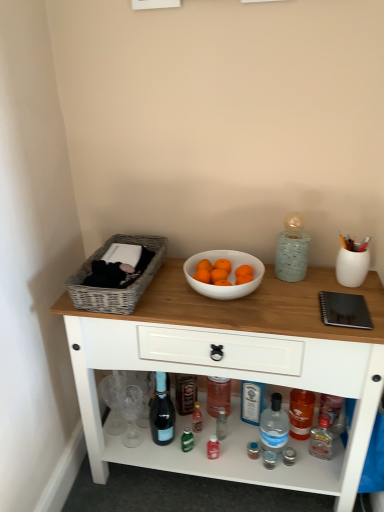
What are the coordinates of `white glossy bowl at center` in the screenshot? It's located at (229, 275).

The image size is (384, 512). Find the location of `matte glass bottle at center, which is the 2th bottle from right to left`. matte glass bottle at center, which is the 2th bottle from right to left is located at coordinates (162, 413).

Where is `transparent plastic bottle at lower center, which ranks as the second bottle in left-to-right order`? Image resolution: width=384 pixels, height=512 pixels. transparent plastic bottle at lower center, which ranks as the second bottle in left-to-right order is located at coordinates (274, 426).

Considering the positions of points (233, 260) and (151, 404), is point (233, 260) farther from camera compared to point (151, 404)?

No, it is not.

Which object is positioned more to the right, white glossy bowl at center or matte glass bottle at center, which is the 2th bottle from right to left?

Positioned to the right is white glossy bowl at center.

Is white glossy bowl at center with matte glass bottle at center, which is the 2th bottle from right to left?

white glossy bowl at center and matte glass bottle at center, which is the 2th bottle from right to left, are clearly separated.

From a real-world perspective, does transparent plastic bottle at lower center, which ranks as the second bottle in left-to-right order, sit lower than wooden table at center?

Yes, from a real-world perspective, transparent plastic bottle at lower center, which ranks as the second bottle in left-to-right order, is under wooden table at center.

Who is smaller, transparent plastic bottle at lower center, placed as the first bottle when sorted from right to left, or wooden table at center?

transparent plastic bottle at lower center, placed as the first bottle when sorted from right to left, is smaller.

Between transparent plastic bottle at lower center, which ranks as the second bottle in left-to-right order, and wooden table at center, which one is positioned behind?

Positioned behind is transparent plastic bottle at lower center, which ranks as the second bottle in left-to-right order.

Visually, is transparent plastic bottle at lower center, placed as the first bottle when sorted from right to left, positioned to the left or to the right of wooden table at center?

Clearly, transparent plastic bottle at lower center, placed as the first bottle when sorted from right to left, is on the right of wooden table at center in the image.

In terms of width, does wooden table at center look wider or thinner when compared to matte glass bottle at center, placed as the 1th bottle when sorted from left to right?

In the image, wooden table at center appears to be wider than matte glass bottle at center, placed as the 1th bottle when sorted from left to right.

Does wooden table at center lie behind matte glass bottle at center, which is the 2th bottle from right to left?

No, it is not.

Based on the photo, what's the angular difference between wooden table at center and matte glass bottle at center, which is the 2th bottle from right to left,'s facing directions?

They differ by 12.5 degrees in their facing directions.

From a real-world perspective, is wooden table at center physically below matte glass bottle at center, placed as the 1th bottle when sorted from left to right?

No.

At what (x,y) coordinates should I click in order to perform the action: click on bowl that is above the wooden table at center (from a real-world perspective). Please return your answer as a coordinate pair (x, y). The image size is (384, 512). Looking at the image, I should click on (229, 275).

Is white glossy bowl at center inside the boundaries of wooden table at center, or outside?

white glossy bowl at center is located beyond the bounds of wooden table at center.

Considering the sizes of objects white glossy bowl at center and wooden table at center in the image provided, who is thinner, white glossy bowl at center or wooden table at center?

white glossy bowl at center.

Is white glossy bowl at center turned away from wooden table at center?

No, white glossy bowl at center is not facing the opposite direction of wooden table at center.

Are woven gray basket at left and white glossy bowl at center located far from each other?

woven gray basket at left is actually quite close to white glossy bowl at center.

Is woven gray basket at left surrounding white glossy bowl at center?

No, white glossy bowl at center is not inside woven gray basket at left.

Looking at the image, does woven gray basket at left seem bigger or smaller compared to white glossy bowl at center?

Considering their sizes, woven gray basket at left takes up more space than white glossy bowl at center.

Is woven gray basket at left positioned in front of white glossy bowl at center?

Yes, woven gray basket at left is in front of white glossy bowl at center.

Does white glossy bowl at center have a greater height compared to woven gray basket at left?

Incorrect, the height of white glossy bowl at center is not larger of that of woven gray basket at left.

From a real-world perspective, which is physically above, white glossy bowl at center or woven gray basket at left?

From a 3D spatial view, white glossy bowl at center is above.

Is white glossy bowl at center not within woven gray basket at left?

Indeed, white glossy bowl at center is completely outside woven gray basket at left.

Based on the photo, considering the relative positions of white glossy bowl at center and woven gray basket at left in the image provided, is white glossy bowl at center behind woven gray basket at left?

Yes, the depth of white glossy bowl at center is greater than that of woven gray basket at left.

From the image's perspective, does transparent plastic bottle at lower center, placed as the first bottle when sorted from right to left, appear lower than white glossy bowl at center?

Yes, from the image's perspective, transparent plastic bottle at lower center, placed as the first bottle when sorted from right to left, is below white glossy bowl at center.

Is transparent plastic bottle at lower center, which ranks as the second bottle in left-to-right order, spatially inside white glossy bowl at center, or outside of it?

The correct answer is: outside.

From a real-world perspective, which is physically below, transparent plastic bottle at lower center, which ranks as the second bottle in left-to-right order, or white glossy bowl at center?

transparent plastic bottle at lower center, which ranks as the second bottle in left-to-right order, is physically lower.

Considering the relative sizes of transparent plastic bottle at lower center, which ranks as the second bottle in left-to-right order, and white glossy bowl at center in the image provided, is transparent plastic bottle at lower center, which ranks as the second bottle in left-to-right order, thinner than white glossy bowl at center?

Correct, the width of transparent plastic bottle at lower center, which ranks as the second bottle in left-to-right order, is less than that of white glossy bowl at center.

At what (x,y) coordinates should I click in order to perform the action: click on bottle that is the 1st object directly below the white glossy bowl at center (from a real-world perspective). Please return your answer as a coordinate pair (x, y). Image resolution: width=384 pixels, height=512 pixels. Looking at the image, I should click on (162, 413).

Where is `bottle that is the 2nd one when counting downward from the wooden table at center (from the image's perspective)`? bottle that is the 2nd one when counting downward from the wooden table at center (from the image's perspective) is located at coordinates [274, 426].

Which object lies further to the anchor point transparent plastic bottle at lower center, which ranks as the second bottle in left-to-right order, wooden table at center or matte glass bottle at center, which is the 2th bottle from right to left?

wooden table at center is positioned further to the anchor transparent plastic bottle at lower center, which ranks as the second bottle in left-to-right order.

When comparing their distances from wooden table at center, does woven gray basket at left or transparent plastic bottle at lower center, which ranks as the second bottle in left-to-right order, seem closer?

woven gray basket at left is closer to wooden table at center.

Considering their positions, is matte glass bottle at center, placed as the 1th bottle when sorted from left to right, positioned closer to wooden table at center than woven gray basket at left?

woven gray basket at left.

Which object lies nearer to the anchor point woven gray basket at left, transparent plastic bottle at lower center, placed as the first bottle when sorted from right to left, or wooden table at center?

Based on the image, wooden table at center appears to be nearer to woven gray basket at left.

When comparing their distances from matte glass bottle at center, which is the 2th bottle from right to left, does transparent plastic bottle at lower center, placed as the first bottle when sorted from right to left, or woven gray basket at left seem further?

The object further to matte glass bottle at center, which is the 2th bottle from right to left, is woven gray basket at left.

Based on their spatial positions, is matte glass bottle at center, placed as the 1th bottle when sorted from left to right, or wooden table at center closer to transparent plastic bottle at lower center, which ranks as the second bottle in left-to-right order?

matte glass bottle at center, placed as the 1th bottle when sorted from left to right, is closer to transparent plastic bottle at lower center, which ranks as the second bottle in left-to-right order.

Estimate the real-world distances between objects in this image. Which object is further from white glossy bowl at center, transparent plastic bottle at lower center, which ranks as the second bottle in left-to-right order, or wooden table at center?

The object further to white glossy bowl at center is transparent plastic bottle at lower center, which ranks as the second bottle in left-to-right order.

Which object lies nearer to the anchor point woven gray basket at left, matte glass bottle at center, placed as the 1th bottle when sorted from left to right, or transparent plastic bottle at lower center, placed as the first bottle when sorted from right to left?

The object closer to woven gray basket at left is matte glass bottle at center, placed as the 1th bottle when sorted from left to right.

Locate an element on the screen. bowl that lies between woven gray basket at left and transparent plastic bottle at lower center, which ranks as the second bottle in left-to-right order, from top to bottom is located at coordinates (229, 275).

The width and height of the screenshot is (384, 512). I want to click on bowl that lies between woven gray basket at left and matte glass bottle at center, placed as the 1th bottle when sorted from left to right, from top to bottom, so click(x=229, y=275).

Where is `table between woven gray basket at left and transparent plastic bottle at lower center, which ranks as the second bottle in left-to-right order, from top to bottom`? The width and height of the screenshot is (384, 512). table between woven gray basket at left and transparent plastic bottle at lower center, which ranks as the second bottle in left-to-right order, from top to bottom is located at coordinates (235, 370).

Image resolution: width=384 pixels, height=512 pixels. Find the location of `bottle between white glossy bowl at center and transparent plastic bottle at lower center, placed as the first bottle when sorted from right to left, in the vertical direction`. bottle between white glossy bowl at center and transparent plastic bottle at lower center, placed as the first bottle when sorted from right to left, in the vertical direction is located at coordinates (162, 413).